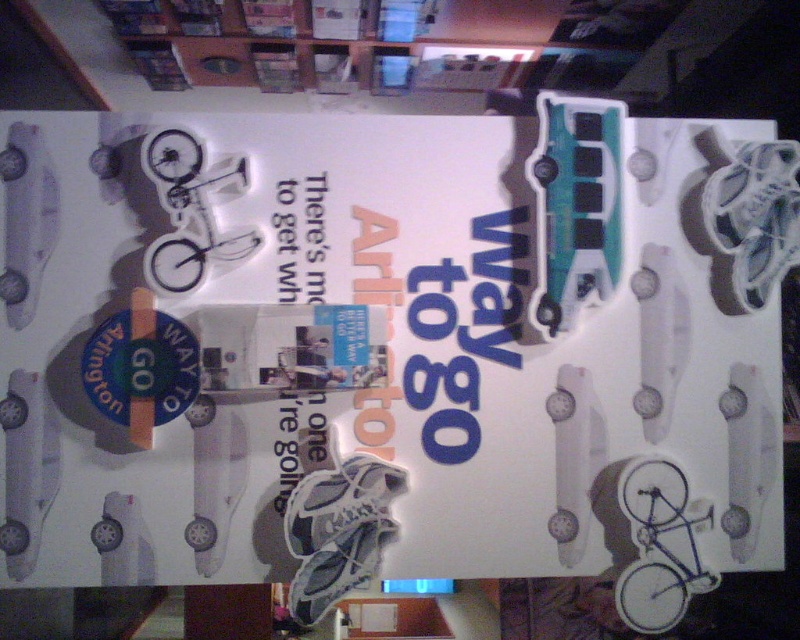
Question: Does white paper poster at center appear on the left side of white paper at center?

Choices:
 (A) no
 (B) yes

Answer: (A)

Question: Which point is farther to the camera?

Choices:
 (A) white paper poster at center
 (B) white paper at center

Answer: (B)

Question: Which point is farther to the camera?

Choices:
 (A) white paper at center
 (B) white paper poster at center

Answer: (A)

Question: Is white paper poster at center positioned before white paper at center?

Choices:
 (A) yes
 (B) no

Answer: (A)

Question: In this image, where is white paper poster at center located relative to white paper at center?

Choices:
 (A) above
 (B) below

Answer: (B)